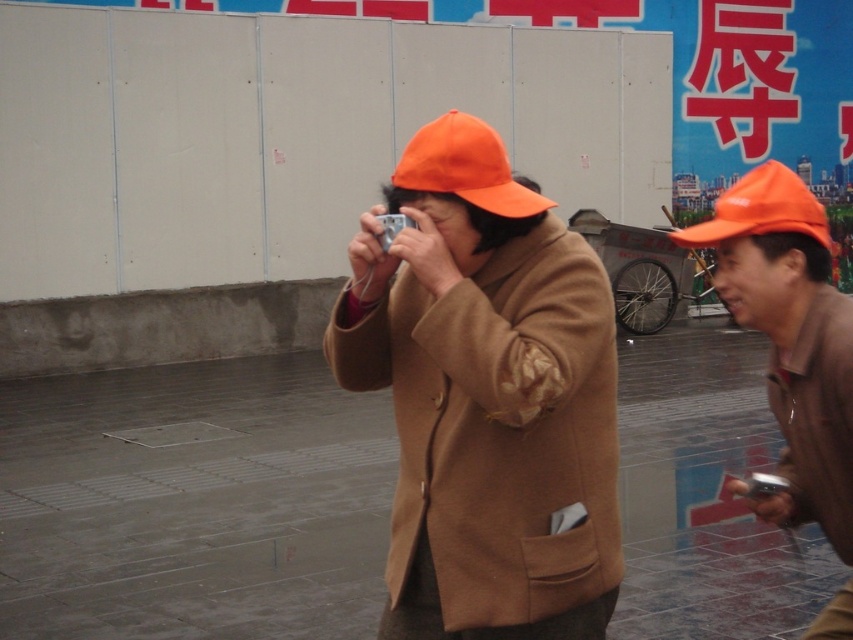
Question: Is matte orange cap at center thinner than orange matte cap at center?

Choices:
 (A) no
 (B) yes

Answer: (A)

Question: Estimate the real-world distances between objects in this image. Which object is closer to the orange matte cap at center?

Choices:
 (A) orange matte hat at upper right
 (B) orange fabric cap at center

Answer: (B)

Question: Which of the following is the farthest from the observer?

Choices:
 (A) orange matte cap at center
 (B) matte orange cap at center
 (C) orange fabric cap at center
 (D) orange matte hat at upper right

Answer: (D)

Question: Can you confirm if matte orange cap at center is bigger than orange matte cap at center?

Choices:
 (A) no
 (B) yes

Answer: (B)

Question: Which of the following is the farthest from the observer?

Choices:
 (A) orange matte cap at center
 (B) orange fabric cap at center

Answer: (B)

Question: In this image, where is orange matte cap at center located relative to orange fabric cap at center?

Choices:
 (A) right
 (B) left

Answer: (A)